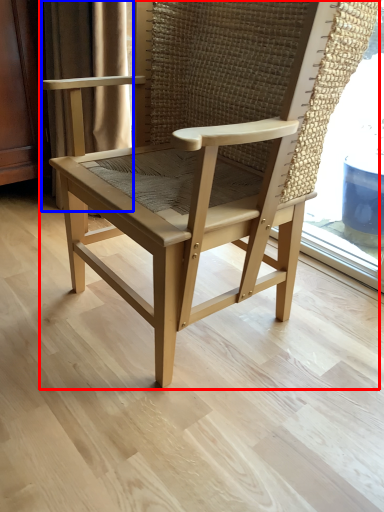
Question: Which object appears closest to the camera in this image, chair (highlighted by a red box) or curtain (highlighted by a blue box)?

Choices:
 (A) chair
 (B) curtain

Answer: (A)